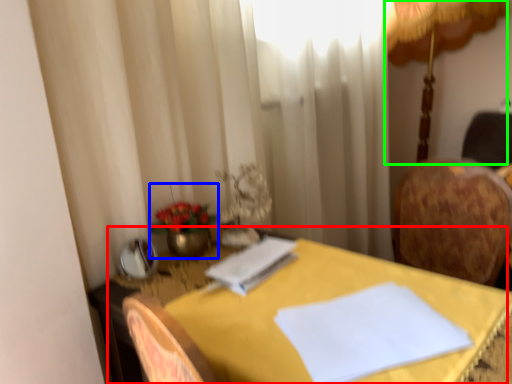
Question: Estimate the real-world distances between objects in this image. Which object is closer to table (highlighted by a red box), floral arrangement (highlighted by a blue box) or table lamp (highlighted by a green box)?

Choices:
 (A) floral arrangement
 (B) table lamp

Answer: (A)